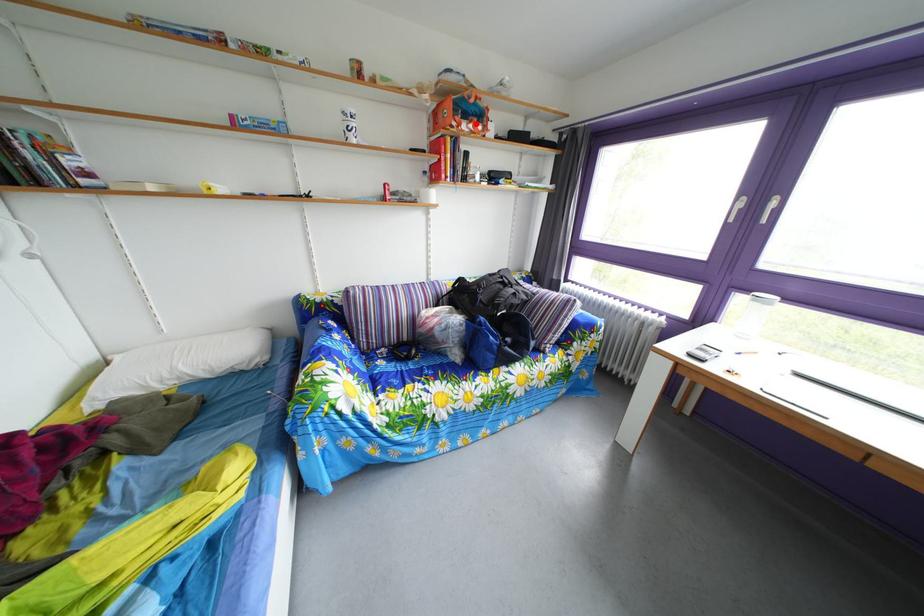
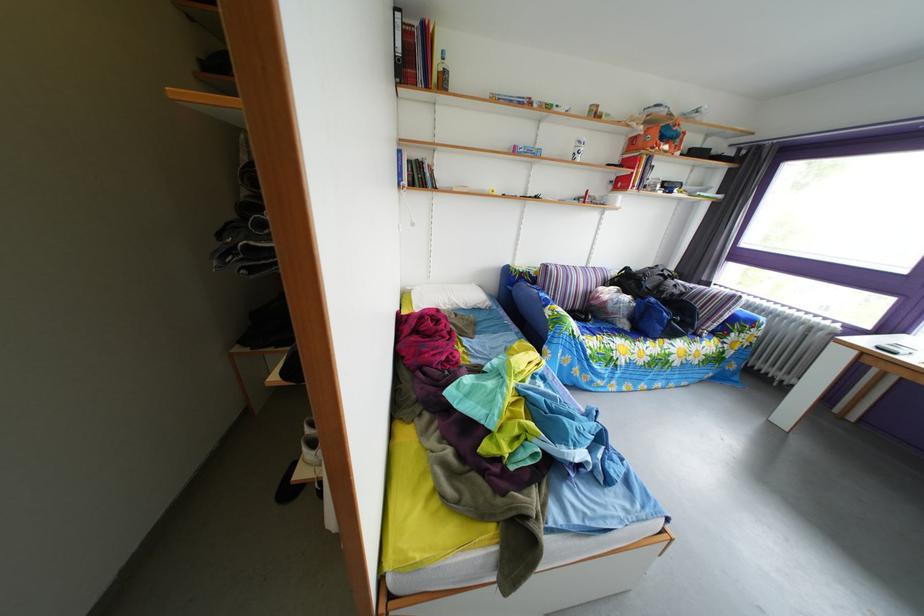
In the second image, find the point that corresponds to the highlighted location in the first image.

(673, 147)